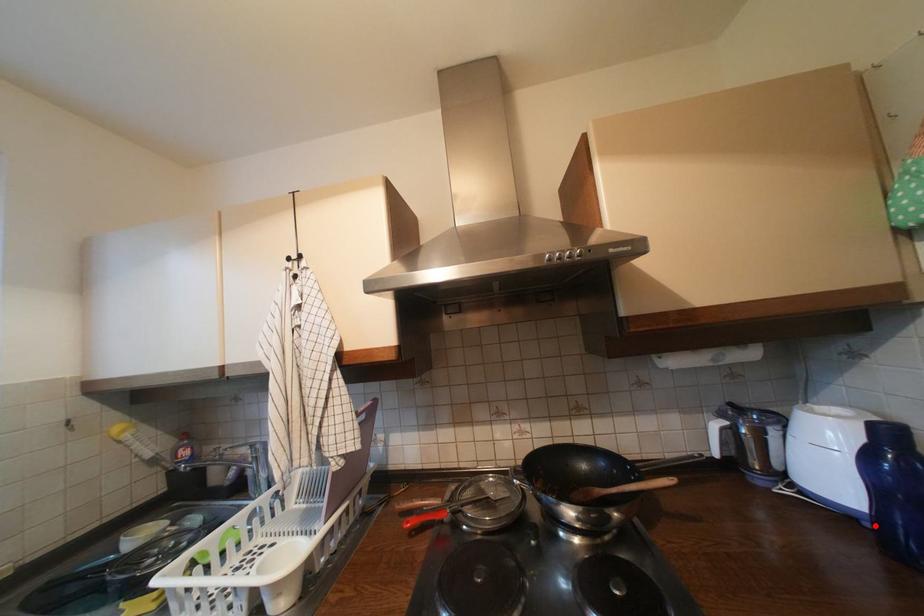
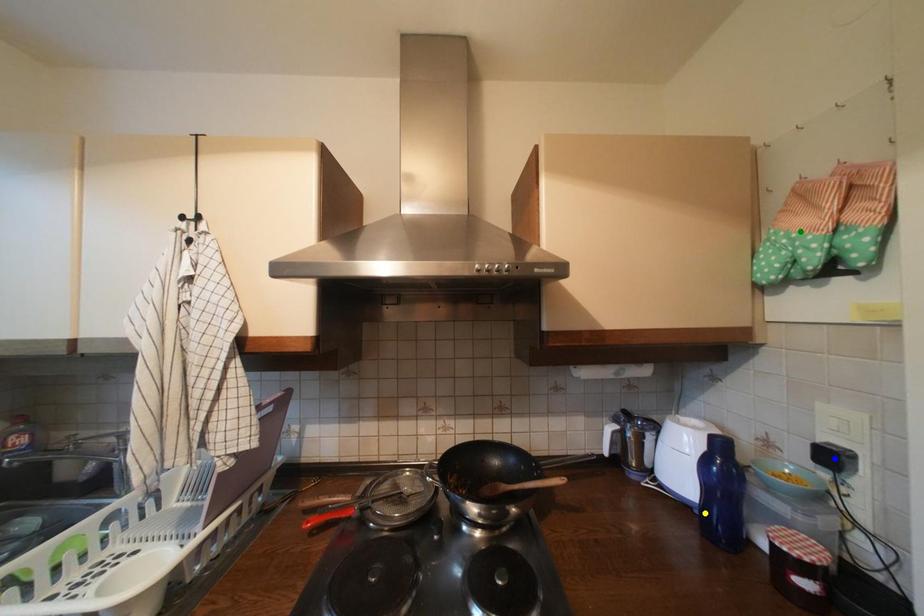
Question: I am providing you with two images of the same scene from different viewpoints. A red point is marked on the first image. You are given multiple points on the second image. Which point in image 2 represents the same 3d spot as the red point in image 1?

Choices:
 (A) yellow point
 (B) blue point
 (C) green point

Answer: (A)